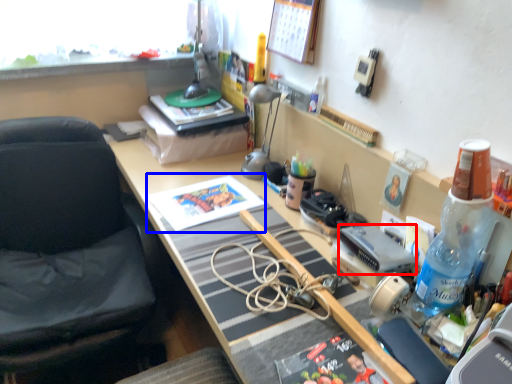
Question: Which object is closer to the camera taking this photo, equipment (highlighted by a red box) or paperback book (highlighted by a blue box)?

Choices:
 (A) equipment
 (B) paperback book

Answer: (A)